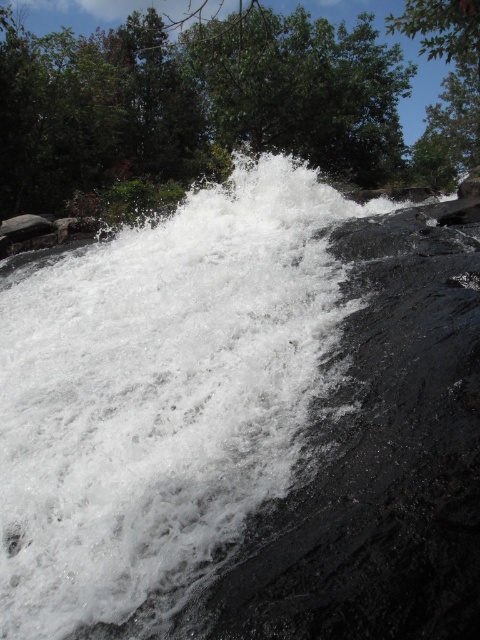
Question: Is white frothy water at center to the right of green leafy tree at upper center from the viewer's perspective?

Choices:
 (A) yes
 (B) no

Answer: (A)

Question: Is white frothy water at center bigger than green leafy tree at upper center?

Choices:
 (A) no
 (B) yes

Answer: (A)

Question: Among these points, which one is nearest to the camera?

Choices:
 (A) (38, 602)
 (B) (351, 58)

Answer: (A)

Question: Considering the relative positions of white frothy water at center and green leafy tree at upper center in the image provided, where is white frothy water at center located with respect to green leafy tree at upper center?

Choices:
 (A) above
 (B) below

Answer: (B)

Question: Which object appears farthest from the camera in this image?

Choices:
 (A) green leafy tree at upper center
 (B) white frothy water at center

Answer: (A)